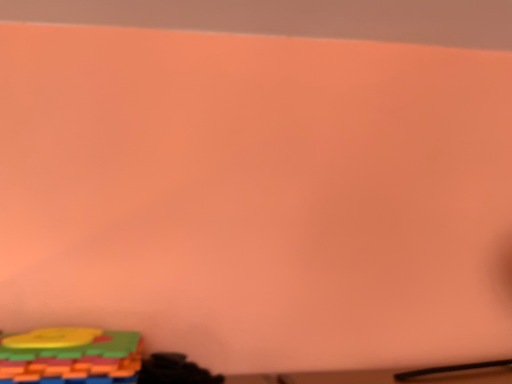
Question: Does point (80, 372) appear closer or farther from the camera than point (190, 382)?

Choices:
 (A) farther
 (B) closer

Answer: (B)

Question: From a real-world perspective, is multicolored plastic blocks at lower left, which is counted as the second toy, starting from the right, positioned above or below black matte toy at lower left, the first toy when ordered from right to left?

Choices:
 (A) above
 (B) below

Answer: (A)

Question: In the image, is multicolored plastic blocks at lower left, positioned as the first toy in left-to-right order, positioned in front of or behind black matte toy at lower left, the second toy positioned from the left?

Choices:
 (A) front
 (B) behind

Answer: (A)

Question: Is point (156, 379) closer or farther from the camera than point (124, 367)?

Choices:
 (A) closer
 (B) farther

Answer: (B)

Question: From the image's perspective, is black matte toy at lower left, the first toy when ordered from right to left, above or below multicolored plastic blocks at lower left, which is counted as the second toy, starting from the right?

Choices:
 (A) above
 (B) below

Answer: (B)

Question: Is black matte toy at lower left, the second toy positioned from the left, in front of or behind multicolored plastic blocks at lower left, positioned as the first toy in left-to-right order, in the image?

Choices:
 (A) front
 (B) behind

Answer: (B)

Question: Is black matte toy at lower left, the second toy positioned from the left, bigger or smaller than multicolored plastic blocks at lower left, positioned as the first toy in left-to-right order?

Choices:
 (A) small
 (B) big

Answer: (A)